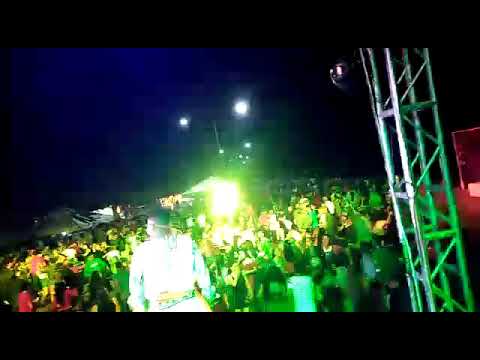
I want to click on stage, so click(471, 215), click(442, 198), click(419, 189), click(442, 219), click(469, 234).